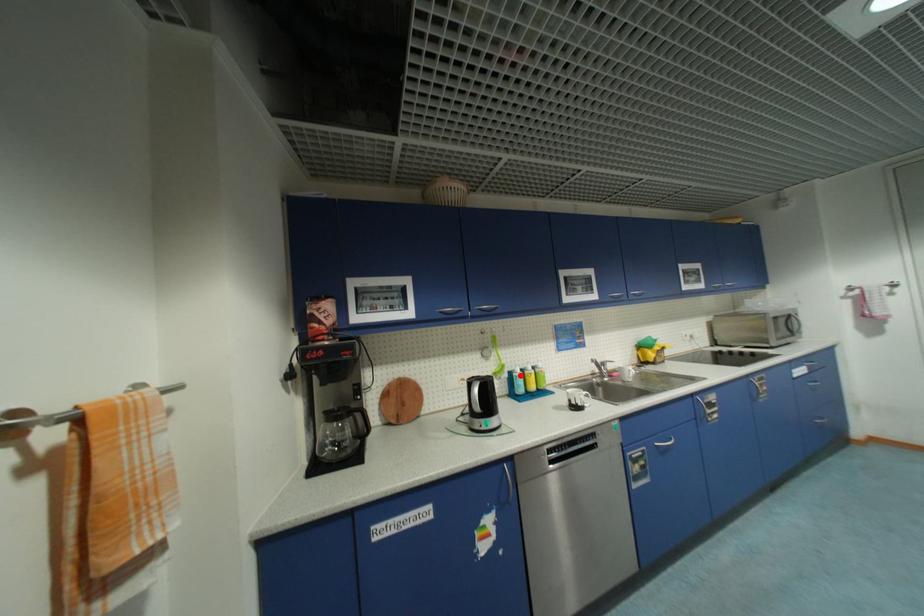
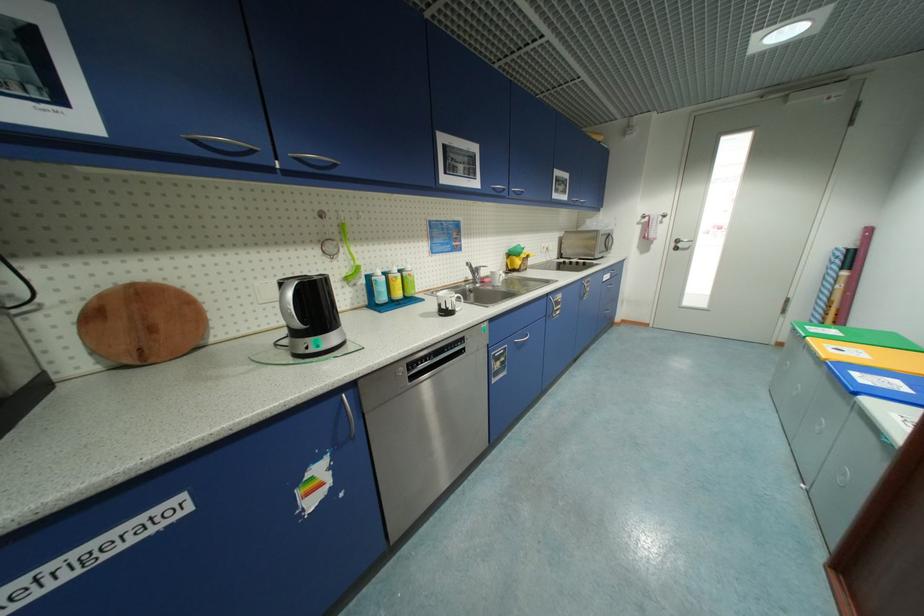
The point at the highlighted location is marked in the first image. Where is the corresponding point in the second image?

(380, 280)